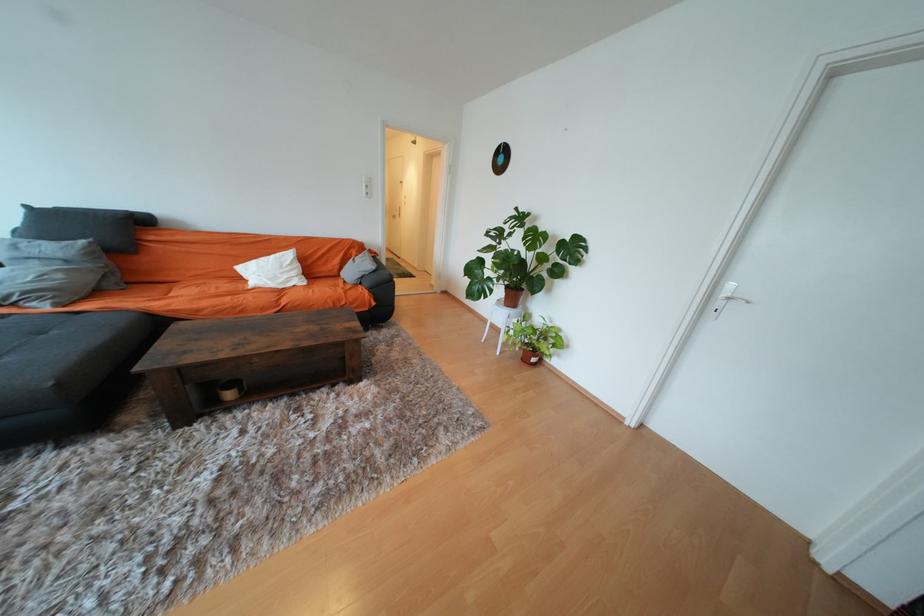
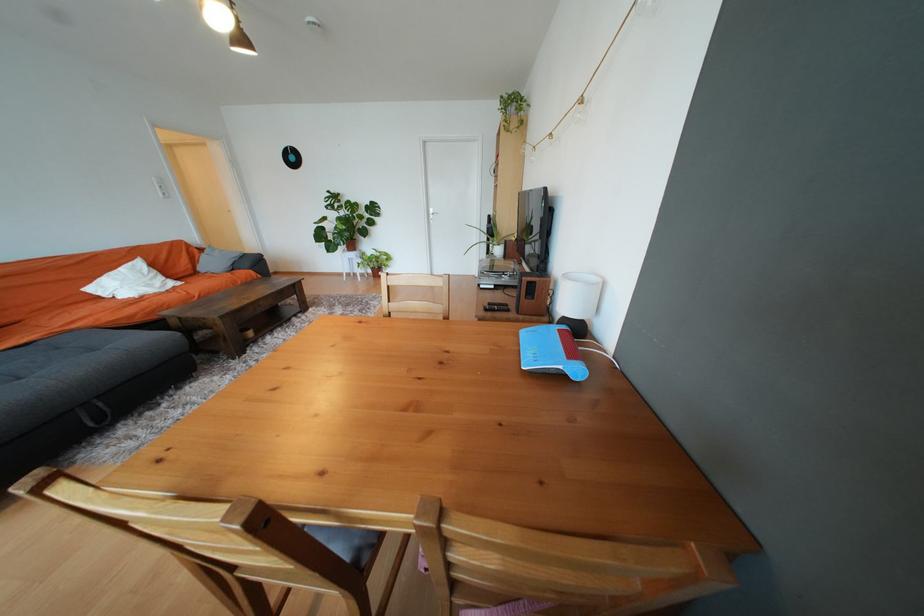
Find the pixel in the second image that matches point (360, 254) in the first image.

(202, 252)